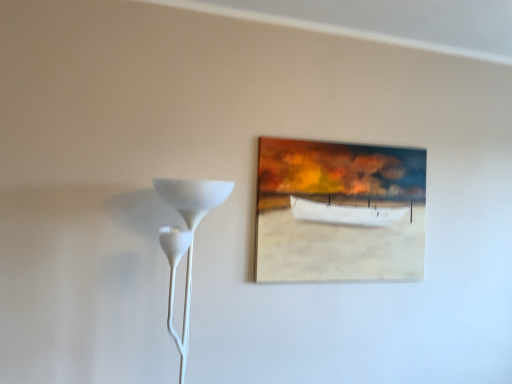
Question: Visually, is white matte floor lamp at left positioned to the left or to the right of oil painting boat at upper center?

Choices:
 (A) right
 (B) left

Answer: (B)

Question: Is white matte floor lamp at left bigger or smaller than oil painting boat at upper center?

Choices:
 (A) big
 (B) small

Answer: (A)

Question: From a real-world perspective, is white matte floor lamp at left physically located above or below oil painting boat at upper center?

Choices:
 (A) above
 (B) below

Answer: (B)

Question: Does point (328, 238) appear closer or farther from the camera than point (222, 188)?

Choices:
 (A) closer
 (B) farther

Answer: (B)

Question: Visually, is oil painting boat at upper center positioned to the left or to the right of white matte floor lamp at left?

Choices:
 (A) right
 (B) left

Answer: (A)

Question: Is oil painting boat at upper center wider or thinner than white matte floor lamp at left?

Choices:
 (A) wide
 (B) thin

Answer: (B)

Question: From the image's perspective, is oil painting boat at upper center above or below white matte floor lamp at left?

Choices:
 (A) above
 (B) below

Answer: (A)